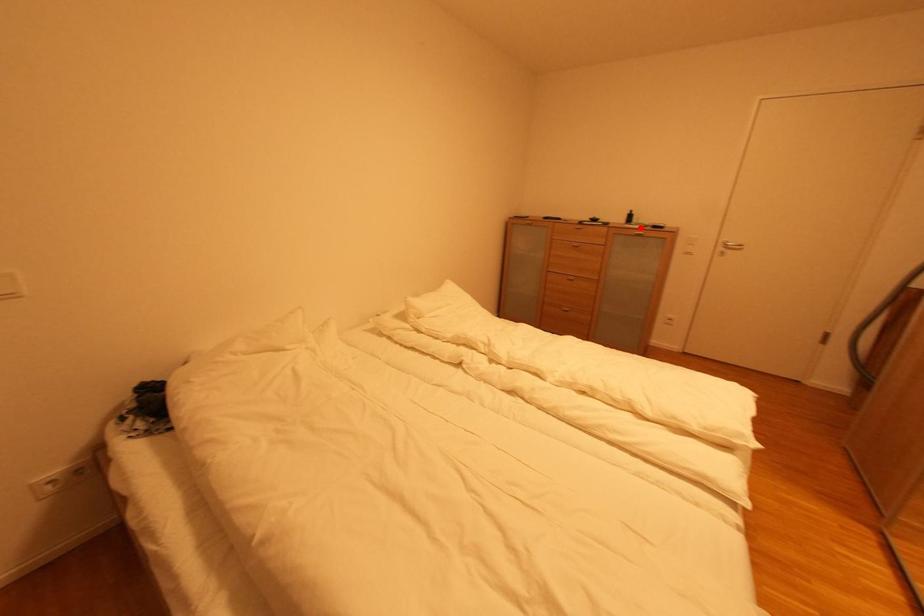
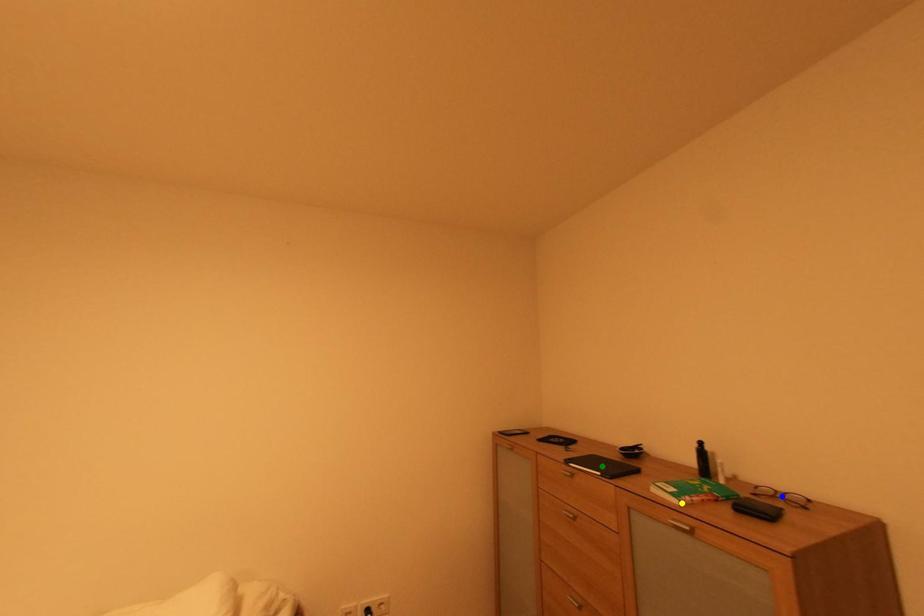
Question: I am providing you with two images of the same scene from different viewpoints. A red point is marked on the first image. You are given multiple points on the second image. Which spot in image 2 lines up with the point in image 1?

Choices:
 (A) blue point
 (B) green point
 (C) yellow point

Answer: (C)